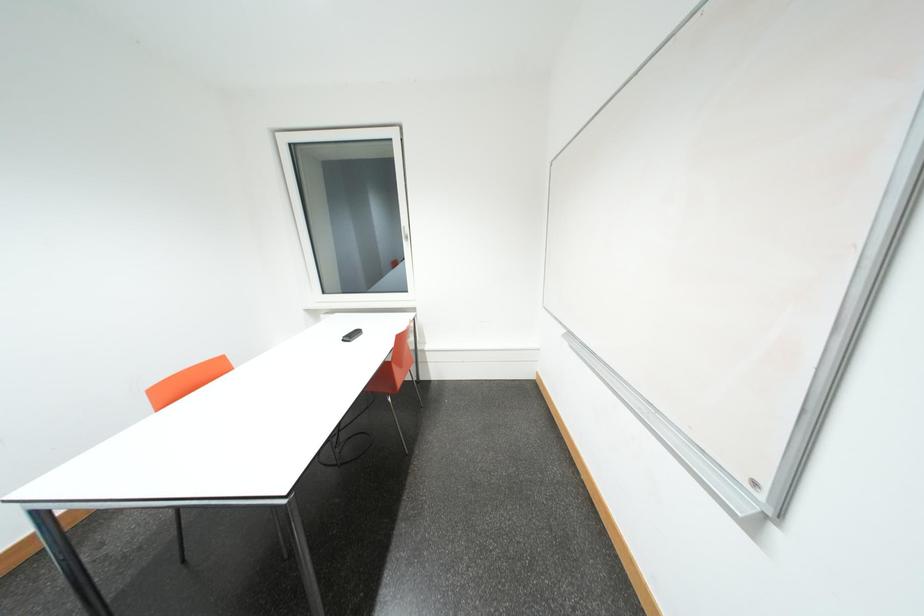
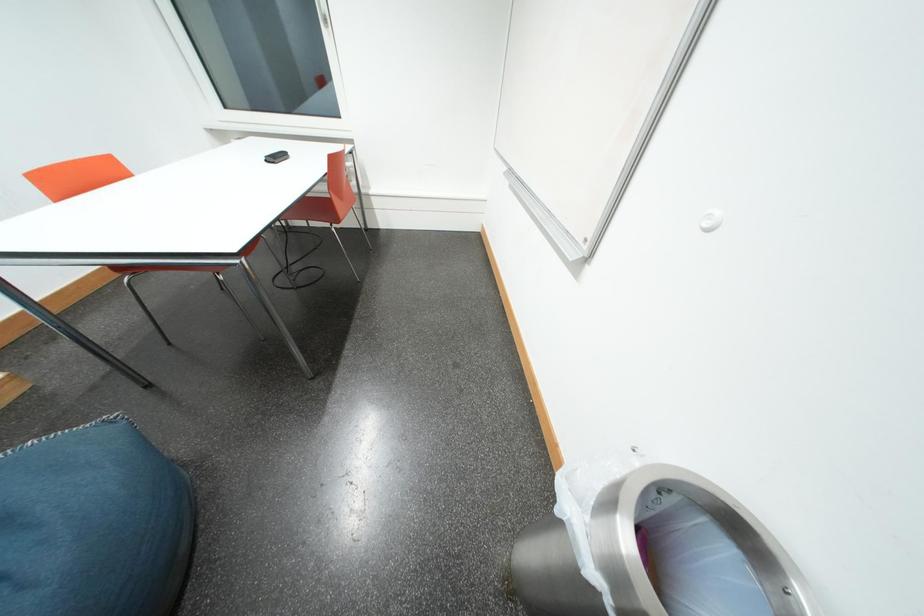
Question: How did the camera likely rotate?

Choices:
 (A) Left
 (B) Right
 (C) Up
 (D) Down

Answer: (D)